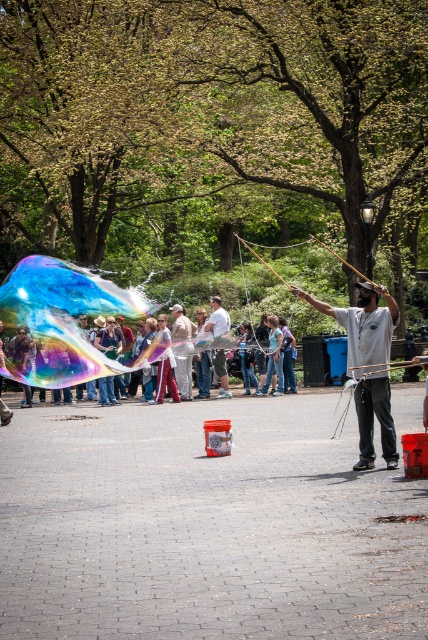
Who is positioned more to the right, light brown leather jacket at center or matte white shirt at center?

matte white shirt at center is more to the right.

Who is taller, light brown leather jacket at center or matte white shirt at center?

With more height is light brown leather jacket at center.

Where is `light brown leather jacket at center`? The width and height of the screenshot is (428, 640). light brown leather jacket at center is located at coordinates (183, 349).

Where is `light brown leather jacket at center`? The width and height of the screenshot is (428, 640). light brown leather jacket at center is located at coordinates point(183,349).

Is point (32, 317) positioned before point (368, 292)?

Yes.

Does rainbow iridescent bubble at center appear under matte black shirt at center?

Incorrect, rainbow iridescent bubble at center is not positioned below matte black shirt at center.

Between point (58, 387) and point (374, 406), which one is positioned behind?

The point (58, 387) is behind.

Identify the location of rainbow iridescent bubble at center. The width and height of the screenshot is (428, 640). (62, 317).

Is matte black shirt at center to the right of light brown leather jacket at center from the viewer's perspective?

Correct, you'll find matte black shirt at center to the right of light brown leather jacket at center.

Is point (380, 337) farther from camera compared to point (189, 364)?

No, it is in front of (189, 364).

Where is `matte black shirt at center`? matte black shirt at center is located at coordinates (362, 323).